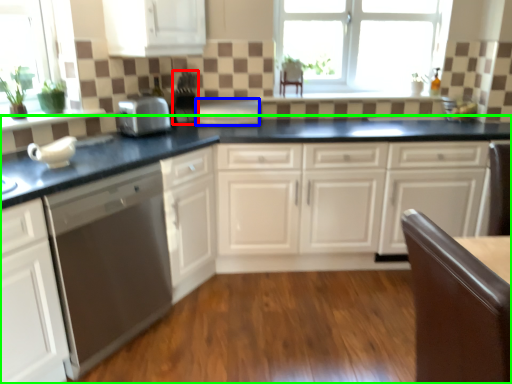
Question: Estimate the real-world distances between objects in this image. Which object is closer to appliance (highlighted by a red box), appliance (highlighted by a blue box) or countertop (highlighted by a green box)?

Choices:
 (A) appliance
 (B) countertop

Answer: (A)